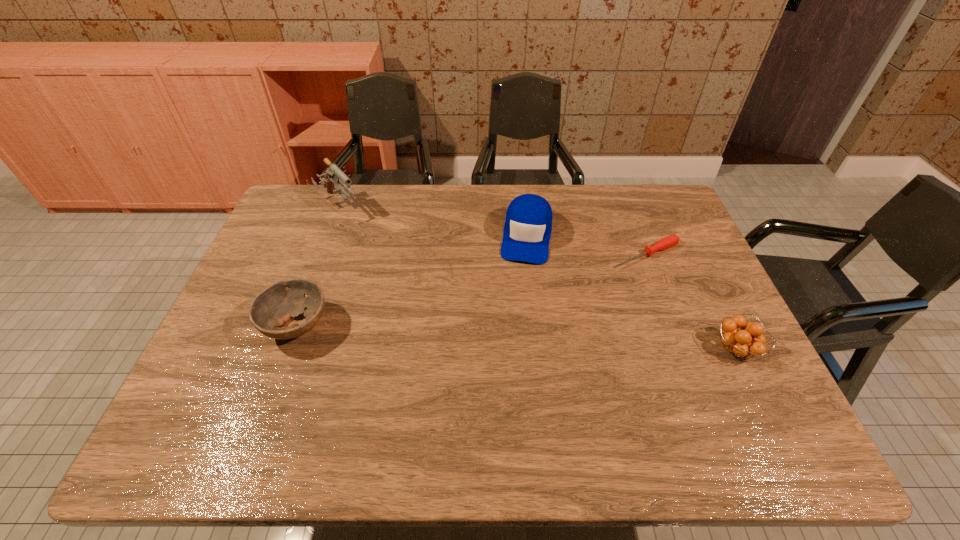
At what (x,y) coordinates should I click in order to perform the action: click on vacant space located at the barrel end of the tallest object. Please return your answer as a coordinate pair (x, y). Looking at the image, I should click on (414, 289).

Identify the location of blank space located 0.190m on the front-facing side of the third object from left to right. (516, 314).

Locate an element on the screen. vacant space positioned 0.090m on the front-facing side of the third object from left to right is located at coordinates point(521,287).

You are a GUI agent. You are given a task and a screenshot of the screen. Output one action in this format:
    pyautogui.click(x=<x>, y=<y>)
    Task: Click on the vacant point located on the front-facing side of the third object from left to right
    This screenshot has height=540, width=960.
    Given the screenshot: What is the action you would take?
    pyautogui.click(x=516, y=316)

Locate an element on the screen. The width and height of the screenshot is (960, 540). vacant area situated at the tip of the shortest object is located at coordinates (577, 281).

This screenshot has height=540, width=960. I want to click on free space located at the tip of the shortest object, so click(x=518, y=308).

Find the location of `vacant space located 0.160m at the tip of the shortest object`. vacant space located 0.160m at the tip of the shortest object is located at coordinates (577, 281).

Image resolution: width=960 pixels, height=540 pixels. What are the coordinates of `gun at the far edge` in the screenshot? It's located at coord(333,174).

Locate an element on the screen. This screenshot has height=540, width=960. baseball cap present at the far edge is located at coordinates (527, 230).

Where is `bowl that is at the left edge`? This screenshot has height=540, width=960. bowl that is at the left edge is located at coordinates (273, 307).